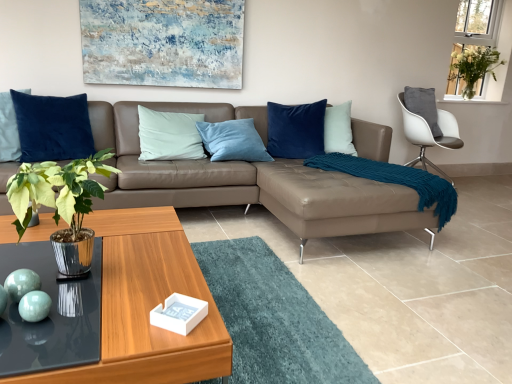
This screenshot has width=512, height=384. Find the location of `vacant area on the back side of teal glossy spheres at lower left, the first teal in the left-to-right sequence`. vacant area on the back side of teal glossy spheres at lower left, the first teal in the left-to-right sequence is located at coordinates (63, 269).